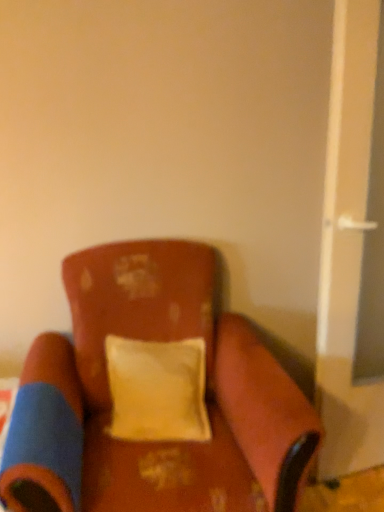
Question: Is velvet-like brown chair at center not near white plastic screen door at right?

Choices:
 (A) yes
 (B) no

Answer: (B)

Question: Is velvet-like brown chair at center taller than white plastic screen door at right?

Choices:
 (A) no
 (B) yes

Answer: (A)

Question: Is velvet-like brown chair at center touching white plastic screen door at right?

Choices:
 (A) no
 (B) yes

Answer: (A)

Question: Is velvet-like brown chair at center located outside white plastic screen door at right?

Choices:
 (A) no
 (B) yes

Answer: (B)

Question: Is velvet-like brown chair at center turned away from white plastic screen door at right?

Choices:
 (A) yes
 (B) no

Answer: (B)

Question: In terms of size, does velvet-like brown chair at center appear bigger or smaller than yellow fabric pillow at center?

Choices:
 (A) small
 (B) big

Answer: (B)

Question: Is velvet-like brown chair at center situated inside yellow fabric pillow at center or outside?

Choices:
 (A) inside
 (B) outside

Answer: (B)

Question: From the image's perspective, relative to yellow fabric pillow at center, is velvet-like brown chair at center above or below?

Choices:
 (A) below
 (B) above

Answer: (A)

Question: From a real-world perspective, relative to yellow fabric pillow at center, is velvet-like brown chair at center vertically above or below?

Choices:
 (A) above
 (B) below

Answer: (B)

Question: From a real-world perspective, is velvet-like brown chair at center positioned above or below white plastic screen door at right?

Choices:
 (A) above
 (B) below

Answer: (B)

Question: Looking at their shapes, would you say velvet-like brown chair at center is wider or thinner than white plastic screen door at right?

Choices:
 (A) wide
 (B) thin

Answer: (A)

Question: Is velvet-like brown chair at center to the left or to the right of white plastic screen door at right in the image?

Choices:
 (A) right
 (B) left

Answer: (B)

Question: Based on their sizes in the image, would you say velvet-like brown chair at center is bigger or smaller than white plastic screen door at right?

Choices:
 (A) big
 (B) small

Answer: (A)

Question: Considering the positions of point (317, 308) and point (183, 368), is point (317, 308) closer or farther from the camera than point (183, 368)?

Choices:
 (A) farther
 (B) closer

Answer: (A)

Question: From a real-world perspective, is white plastic screen door at right physically located above or below yellow fabric pillow at center?

Choices:
 (A) above
 (B) below

Answer: (A)